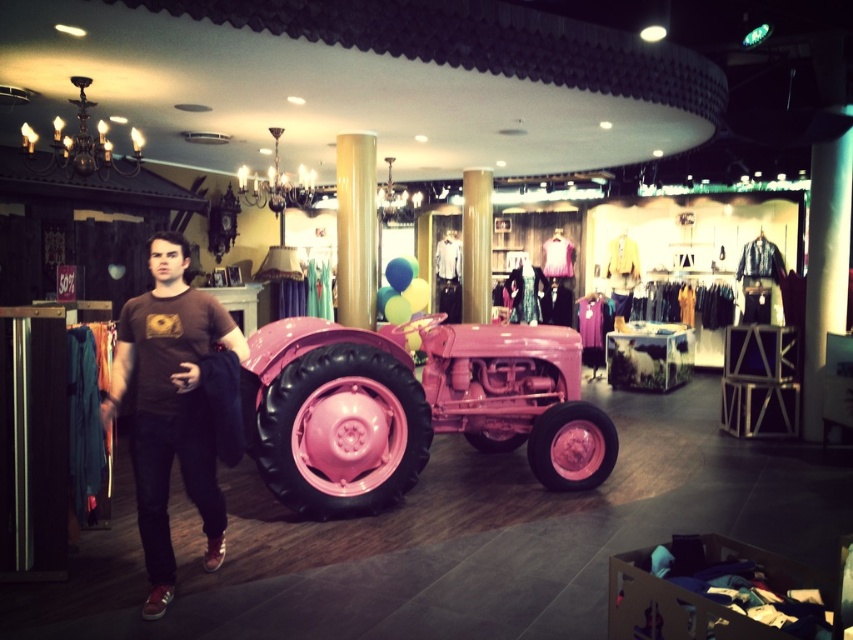
Does point (332, 412) come behind point (204, 516)?

Yes.

Does pink glossy tractor at center come in front of brown cotton t-shirt at center?

No.

At what (x,y) coordinates should I click in order to perform the action: click on pink glossy tractor at center. Please return your answer as a coordinate pair (x, y). Looking at the image, I should click on (412, 408).